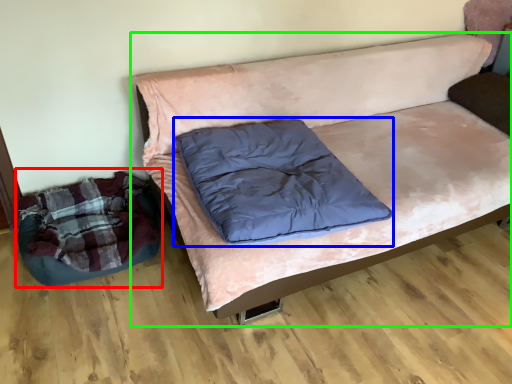
Question: Which object is positioned closest to bean bag chair (highlighted by a red box)? Select from pillow (highlighted by a blue box) and studio couch (highlighted by a green box).

Choices:
 (A) pillow
 (B) studio couch

Answer: (A)